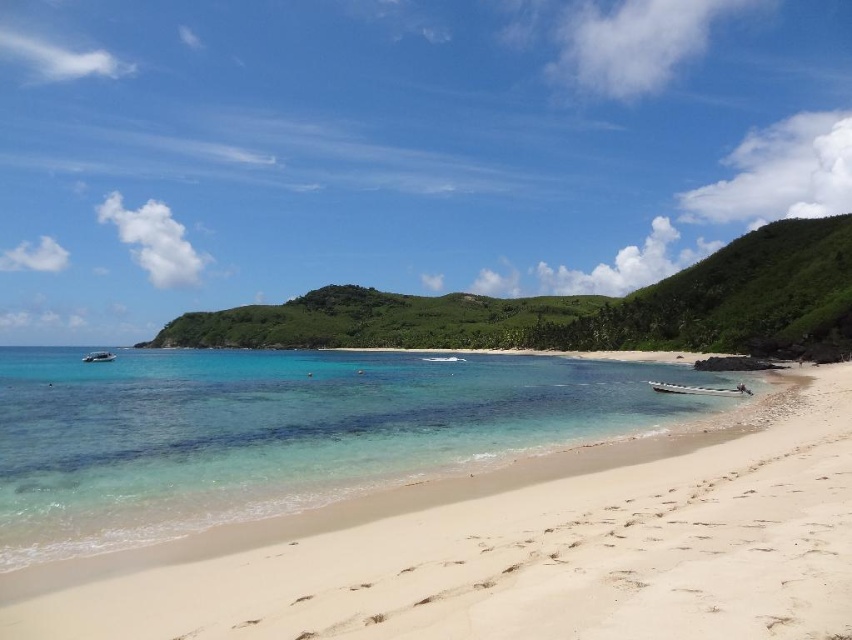
Which is in front, point (176, 342) or point (95, 360)?

Point (95, 360) is in front.

Is green leafy island at center taller than white glossy boat at left?

Indeed, green leafy island at center has a greater height compared to white glossy boat at left.

Who is more forward, (594, 317) or (93, 355)?

Point (93, 355) is more forward.

The image size is (852, 640). In order to click on green leafy island at center in this screenshot , I will do `click(584, 308)`.

Who is taller, white sandy beach at lower left or white glossy boat at left?

white sandy beach at lower left is taller.

Describe the element at coordinates (515, 554) in the screenshot. The height and width of the screenshot is (640, 852). I see `white sandy beach at lower left` at that location.

Who is more forward, (x=586, y=611) or (x=91, y=356)?

Point (x=586, y=611) is in front.

Find the location of a particular element. white sandy beach at lower left is located at coordinates (515, 554).

Does white sandy beach at lower left have a smaller size compared to green leafy island at center?

Yes.

Between white sandy beach at lower left and green leafy island at center, which one has less height?

white sandy beach at lower left

Who is more forward, (136, 624) or (522, 305)?

Point (136, 624) is in front.

Where is `white sandy beach at lower left`? The width and height of the screenshot is (852, 640). white sandy beach at lower left is located at coordinates (515, 554).